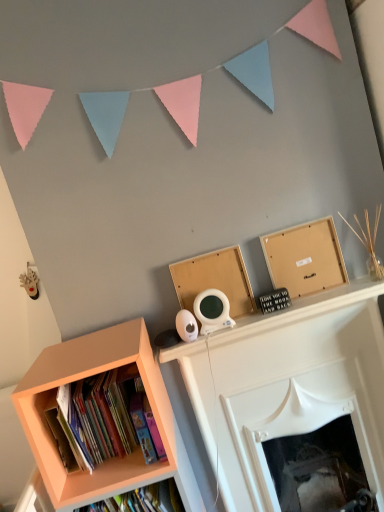
Locate an element on the screen. The image size is (384, 512). blank space above matte orange bookcase at lower left (from a real-world perspective) is located at coordinates (76, 351).